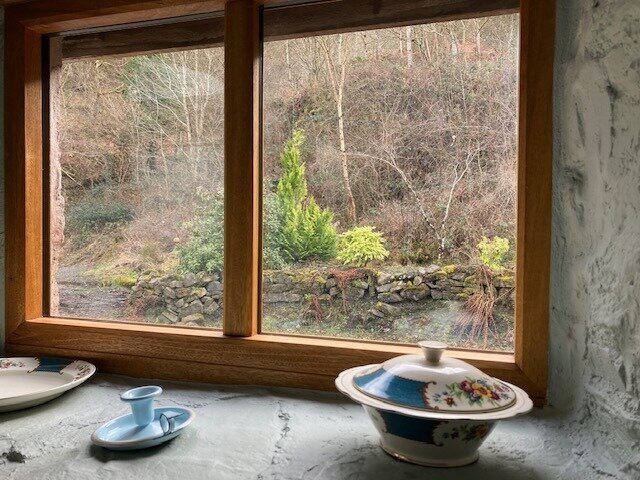
Locate an element on the screen. This screenshot has width=640, height=480. rough stone windowsill is located at coordinates (266, 435).